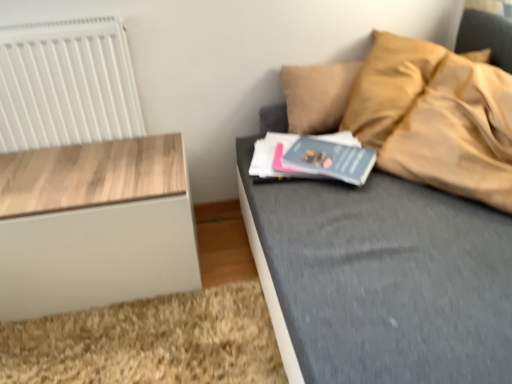
Question: From the image's perspective, is wooden nightstand at left located beneath gray matte book at center?

Choices:
 (A) no
 (B) yes

Answer: (B)

Question: Considering the relative positions of wooden nightstand at left and gray matte book at center in the image provided, is wooden nightstand at left in front of gray matte book at center?

Choices:
 (A) no
 (B) yes

Answer: (B)

Question: Does wooden nightstand at left appear on the right side of gray matte book at center?

Choices:
 (A) yes
 (B) no

Answer: (B)

Question: Is wooden nightstand at left completely or partially outside of gray matte book at center?

Choices:
 (A) no
 (B) yes

Answer: (B)

Question: Does wooden nightstand at left have a lesser width compared to gray matte book at center?

Choices:
 (A) no
 (B) yes

Answer: (A)

Question: From the image's perspective, is wooden nightstand at left over gray matte book at center?

Choices:
 (A) yes
 (B) no

Answer: (B)

Question: Does gray matte book at center have a smaller size compared to wooden nightstand at left?

Choices:
 (A) yes
 (B) no

Answer: (A)

Question: Is wooden nightstand at left a part of gray matte book at center?

Choices:
 (A) yes
 (B) no

Answer: (B)

Question: Is gray matte book at center at the left side of wooden nightstand at left?

Choices:
 (A) no
 (B) yes

Answer: (A)

Question: From the image's perspective, would you say gray matte book at center is shown under wooden nightstand at left?

Choices:
 (A) yes
 (B) no

Answer: (B)

Question: Is gray matte book at center bigger than wooden nightstand at left?

Choices:
 (A) no
 (B) yes

Answer: (A)

Question: Is the depth of gray matte book at center greater than that of wooden nightstand at left?

Choices:
 (A) no
 (B) yes

Answer: (B)

Question: Is wooden nightstand at left oriented away from white plastic radiator at upper left?

Choices:
 (A) yes
 (B) no

Answer: (B)